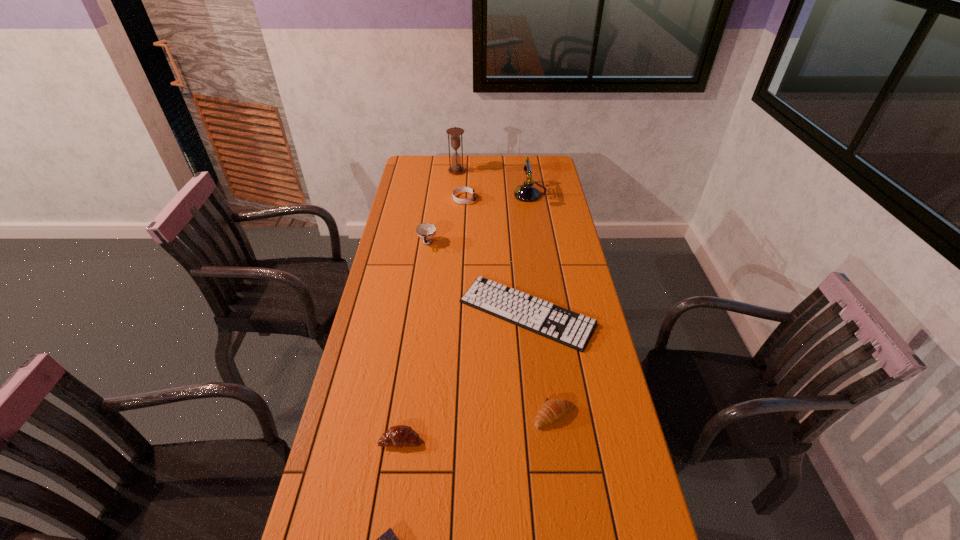
You are a GUI agent. You are given a task and a screenshot of the screen. Output one action in this format:
    pyautogui.click(x=<x>, y=<y>)
    Task: Click on the free spot between the second tallest object and the tallest object
    Image resolution: width=960 pixels, height=540 pixels.
    Given the screenshot: What is the action you would take?
    pyautogui.click(x=493, y=183)

Where is `free space between the hourglass and the fourth nearest object`? The width and height of the screenshot is (960, 540). free space between the hourglass and the fourth nearest object is located at coordinates (492, 242).

This screenshot has height=540, width=960. Find the location of `vacant space in between the fourth nearest object and the left crescent roll`. vacant space in between the fourth nearest object and the left crescent roll is located at coordinates (464, 376).

Locate which object is the sixth closest to the left crescent roll. Please provide its 2D coordinates. Your answer should be formatted as a tuple, i.e. [(x, y)], where the tuple contains the x and y coordinates of a point satisfying the conditions above.

[(527, 192)]

Select which object is the fourth closest to the third tallest object. Please provide its 2D coordinates. Your answer should be formatted as a tuple, i.e. [(x, y)], where the tuple contains the x and y coordinates of a point satisfying the conditions above.

[(455, 132)]

This screenshot has height=540, width=960. What are the coordinates of `free spot that satisfies the following two spatial constraints: 1. on the outer surface of the wristband; 2. on the right side of the computer keyboard` in the screenshot? It's located at (458, 313).

Locate an element on the screen. This screenshot has width=960, height=540. free space that satisfies the following two spatial constraints: 1. on the outer surface of the wristband; 2. on the right side of the right crescent roll is located at coordinates (452, 415).

Locate an element on the screen. Image resolution: width=960 pixels, height=540 pixels. vacant point that satisfies the following two spatial constraints: 1. on the side of the fourth farthest object with the handle; 2. on the left side of the computer keyboard is located at coordinates (418, 313).

The image size is (960, 540). Identify the location of free space that satisfies the following two spatial constraints: 1. on the side of the sixth shortest object with the handle; 2. on the left side of the fifth farthest object. (418, 313).

Where is `free location that satisfies the following two spatial constraints: 1. on the front side of the fifth farthest object; 2. on the right side of the right crescent roll`? Image resolution: width=960 pixels, height=540 pixels. free location that satisfies the following two spatial constraints: 1. on the front side of the fifth farthest object; 2. on the right side of the right crescent roll is located at coordinates (538, 415).